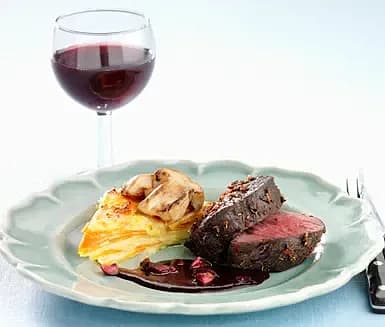
I want to click on wineglass, so click(88, 32).